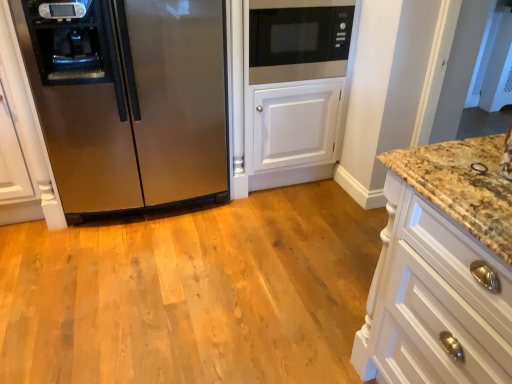
Image resolution: width=512 pixels, height=384 pixels. In order to click on white wood cabinet at right in this screenshot , I will do `click(442, 269)`.

What do you see at coordinates (130, 100) in the screenshot? Image resolution: width=512 pixels, height=384 pixels. I see `stainless steel refrigerator at left` at bounding box center [130, 100].

You are a GUI agent. You are given a task and a screenshot of the screen. Output one action in this format:
    pyautogui.click(x=<x>, y=<y>)
    Task: Click on the white wood cabinet at right
    This screenshot has height=384, width=512.
    Given the screenshot: What is the action you would take?
    pyautogui.click(x=442, y=269)

From a real-world perspective, is black matte microwave at upper center beneath white wood cabinet at right?

Actually, black matte microwave at upper center is physically above white wood cabinet at right in the real world.

Is black matte microwave at upper center bigger than white wood cabinet at right?

No.

Is there a large distance between black matte microwave at upper center and white wood cabinet at right?

black matte microwave at upper center is far away from white wood cabinet at right.

Is black matte microwave at upper center positioned far away from stainless steel refrigerator at left?

No, there isn't a large distance between black matte microwave at upper center and stainless steel refrigerator at left.

From the image's perspective, which is below, black matte microwave at upper center or stainless steel refrigerator at left?

stainless steel refrigerator at left, from the image's perspective.

From a real-world perspective, is black matte microwave at upper center positioned under stainless steel refrigerator at left based on gravity?

Incorrect, from a real-world perspective, black matte microwave at upper center is higher than stainless steel refrigerator at left.

Considering the relative sizes of black matte microwave at upper center and stainless steel refrigerator at left in the image provided, is black matte microwave at upper center thinner than stainless steel refrigerator at left?

Yes, black matte microwave at upper center is thinner than stainless steel refrigerator at left.

Is stainless steel refrigerator at left aimed at black matte microwave at upper center?

No, stainless steel refrigerator at left is not facing towards black matte microwave at upper center.

Which is more to the right, stainless steel refrigerator at left or black matte microwave at upper center?

black matte microwave at upper center.

Is stainless steel refrigerator at left next to black matte microwave at upper center and touching it?

No, stainless steel refrigerator at left is not next to black matte microwave at upper center.

Measure the distance from white wood cabinet at right to stainless steel refrigerator at left.

A distance of 1.42 meters exists between white wood cabinet at right and stainless steel refrigerator at left.

Is white wood cabinet at right in front of or behind stainless steel refrigerator at left in the image?

In the image, white wood cabinet at right appears in front of stainless steel refrigerator at left.

Find the location of a particular element. refrigerator lying on the left of white wood cabinet at right is located at coordinates (130, 100).

Is white wood cabinet at right far from stainless steel refrigerator at left?

Yes, white wood cabinet at right and stainless steel refrigerator at left are located far from each other.

Is white wood cabinet at right thinner than black matte microwave at upper center?

Incorrect, the width of white wood cabinet at right is not less than that of black matte microwave at upper center.

Locate an element on the screen. microwave oven that is above the white wood cabinet at right (from the image's perspective) is located at coordinates (298, 39).

Is black matte microwave at upper center at the back of white wood cabinet at right?

No, white wood cabinet at right is not facing away from black matte microwave at upper center.

Between stainless steel refrigerator at left and white wood cabinet at right, which one has more height?

Standing taller between the two is stainless steel refrigerator at left.

Can we say stainless steel refrigerator at left lies outside white wood cabinet at right?

Absolutely, stainless steel refrigerator at left is external to white wood cabinet at right.

Does stainless steel refrigerator at left lie behind white wood cabinet at right?

Yes, stainless steel refrigerator at left is further from the viewer.

In the image, is stainless steel refrigerator at left on the left side or the right side of white wood cabinet at right?

stainless steel refrigerator at left is to the left of white wood cabinet at right.

Where is `microwave oven lying behind the white wood cabinet at right`? microwave oven lying behind the white wood cabinet at right is located at coordinates (298, 39).

Where is `microwave oven that appears on the right of stainless steel refrigerator at left`? This screenshot has width=512, height=384. microwave oven that appears on the right of stainless steel refrigerator at left is located at coordinates (298, 39).

When comparing their distances from white wood cabinet at right, does black matte microwave at upper center or stainless steel refrigerator at left seem further?

stainless steel refrigerator at left is positioned further to the anchor white wood cabinet at right.

When comparing their distances from stainless steel refrigerator at left, does white wood cabinet at right or black matte microwave at upper center seem closer?

black matte microwave at upper center lies closer to stainless steel refrigerator at left than the other object.

Considering their positions, is white wood cabinet at right positioned further to black matte microwave at upper center than stainless steel refrigerator at left?

Among the two, white wood cabinet at right is located further to black matte microwave at upper center.

Looking at the image, which one is located further to stainless steel refrigerator at left, black matte microwave at upper center or white wood cabinet at right?

Based on the image, white wood cabinet at right appears to be further to stainless steel refrigerator at left.

Estimate the real-world distances between objects in this image. Which object is closer to white wood cabinet at right, stainless steel refrigerator at left or black matte microwave at upper center?

Based on the image, black matte microwave at upper center appears to be nearer to white wood cabinet at right.

Estimate the real-world distances between objects in this image. Which object is further from black matte microwave at upper center, stainless steel refrigerator at left or white wood cabinet at right?

Among the two, white wood cabinet at right is located further to black matte microwave at upper center.

You are a GUI agent. You are given a task and a screenshot of the screen. Output one action in this format:
    pyautogui.click(x=<x>, y=<y>)
    Task: Click on the refrigerator between white wood cabinet at right and black matte microwave at upper center from front to back
    Image resolution: width=512 pixels, height=384 pixels.
    Given the screenshot: What is the action you would take?
    pyautogui.click(x=130, y=100)